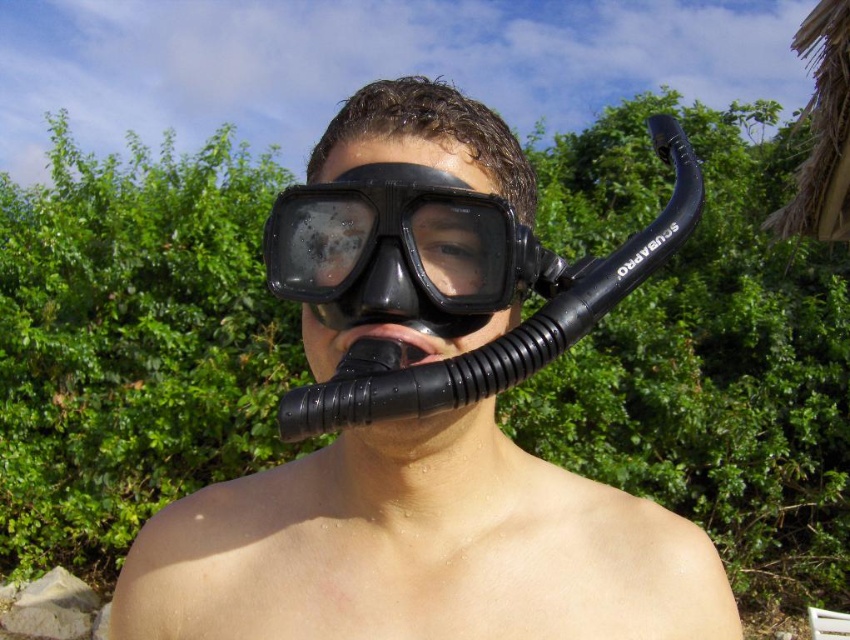
Question: Is black matte snorkel at center smaller than black matte snorkel mask at center?

Choices:
 (A) yes
 (B) no

Answer: (B)

Question: Can you confirm if black rubber snorkel at center is bigger than black matte snorkel mask at center?

Choices:
 (A) no
 (B) yes

Answer: (B)

Question: Is black matte snorkel at center below black rubber snorkel at center?

Choices:
 (A) yes
 (B) no

Answer: (A)

Question: Which point appears closest to the camera in this image?

Choices:
 (A) tap(537, 636)
 (B) tap(287, 253)

Answer: (B)

Question: Which point is farther to the camera?

Choices:
 (A) (457, 241)
 (B) (656, 588)

Answer: (B)

Question: Which object appears closest to the camera in this image?

Choices:
 (A) black matte snorkel mask at center
 (B) black rubber snorkel at center

Answer: (B)